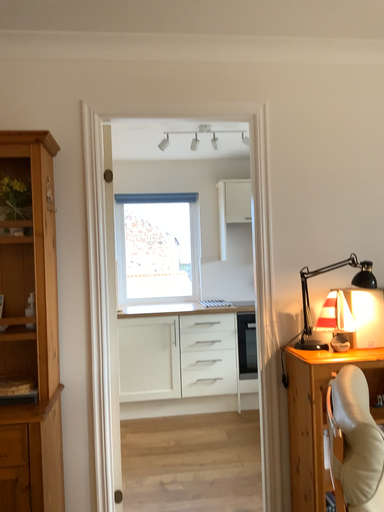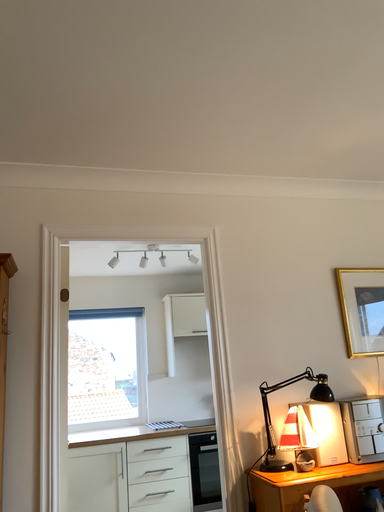
Question: Which way did the camera rotate in the video?

Choices:
 (A) rotated downward
 (B) rotated upward

Answer: (B)